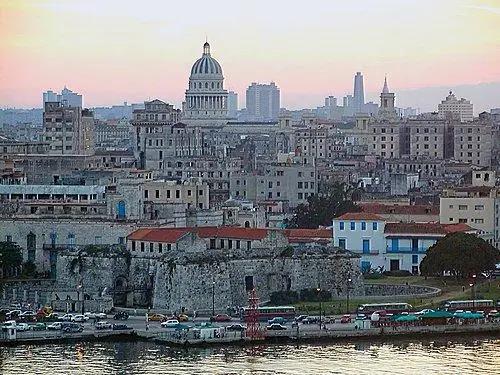
Identify the location of blue doors. (367, 248), (392, 248), (122, 213), (367, 267).